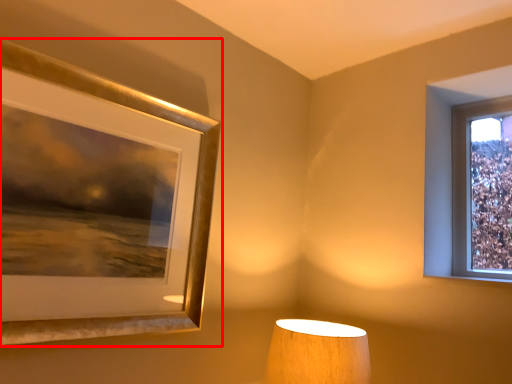
Question: Observing the image, what is the correct spatial positioning of picture frame (annotated by the red box) in reference to lamp?

Choices:
 (A) right
 (B) left

Answer: (B)